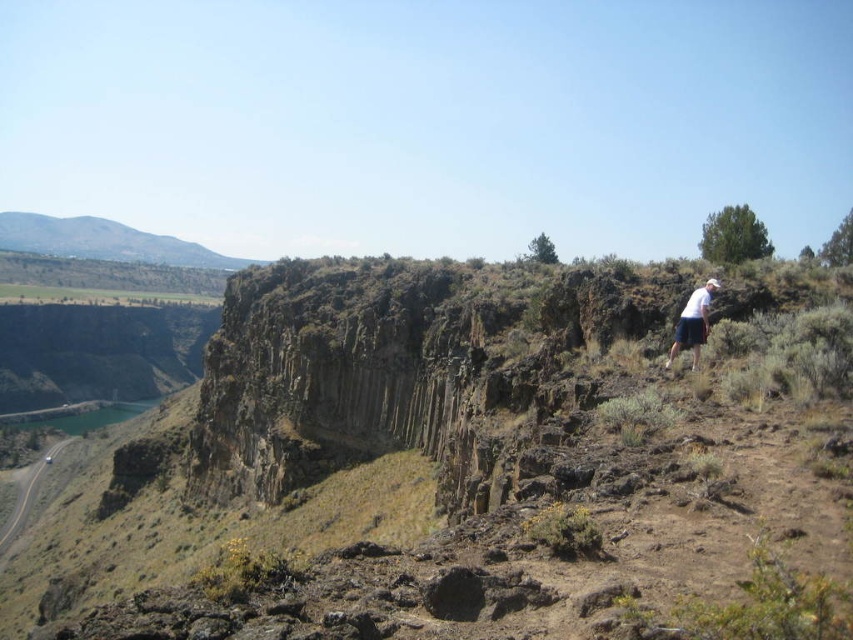
Question: Can you confirm if smooth asphalt road at lower left is positioned to the left of white cotton shirt at upper right?

Choices:
 (A) no
 (B) yes

Answer: (B)

Question: Estimate the real-world distances between objects in this image. Which object is closer to the green grassy hill at upper left?

Choices:
 (A) white cotton shirt at upper right
 (B) smooth asphalt road at lower left

Answer: (B)

Question: Based on their relative distances, which object is farther from the green grassy hill at upper left?

Choices:
 (A) white cotton shirt at upper right
 (B) smooth asphalt road at lower left

Answer: (A)

Question: Is green grassy hill at upper left further to the viewer compared to smooth asphalt road at lower left?

Choices:
 (A) no
 (B) yes

Answer: (B)

Question: Among these points, which one is nearest to the camera?

Choices:
 (A) (68, 257)
 (B) (73, 440)

Answer: (B)

Question: From the image, what is the correct spatial relationship of green grassy hill at upper left in relation to smooth asphalt road at lower left?

Choices:
 (A) above
 (B) below

Answer: (A)